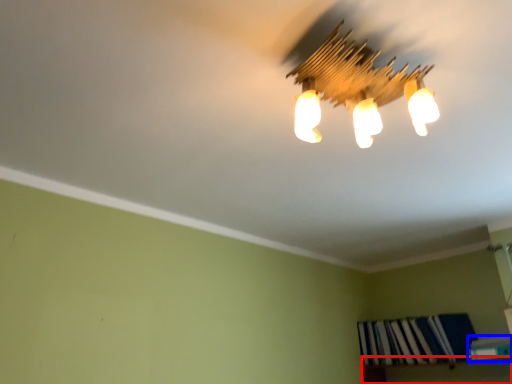
Question: Which object appears farthest to the camera in this image, shelf (highlighted by a red box) or book (highlighted by a blue box)?

Choices:
 (A) shelf
 (B) book

Answer: (B)